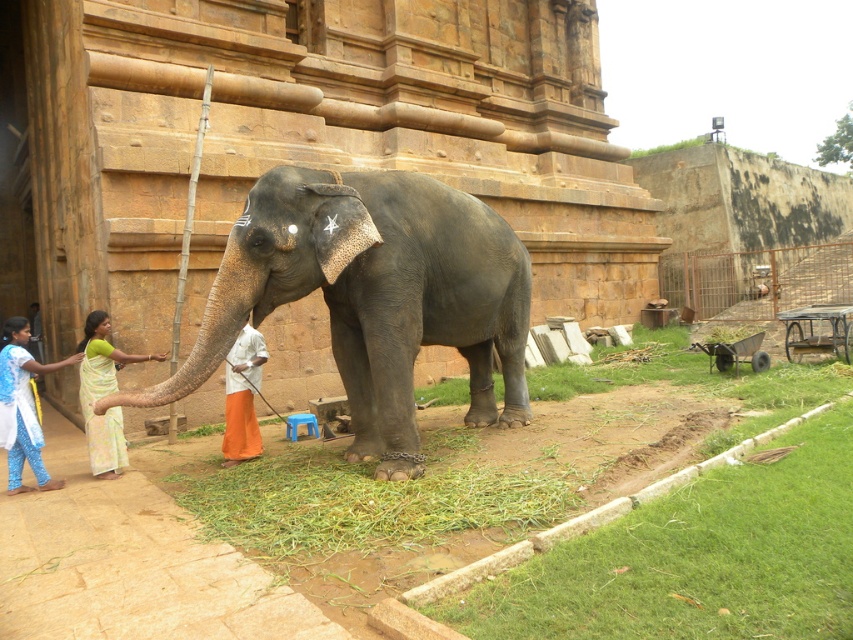
Based on the photo, you are standing in front of a temple and see the gray textured elephant at center. If you want to safely approach it without getting too close, what is the minimum distance you should maintain?

The gray textured elephant at center is 4.93 meters away from the viewer, so to safely approach without getting too close, you should maintain a minimum distance of at least 4.93 meters.

You are organizing a cultural event and need to choose between the blue cotton dress at lower left and the orange cloth at center for a traditional dance performance. Which garment would you select if you want a wider costume for better movement?

The blue cotton dress at lower left is wider than the orange cloth at center, so it would be better for the dance performance requiring more movement.